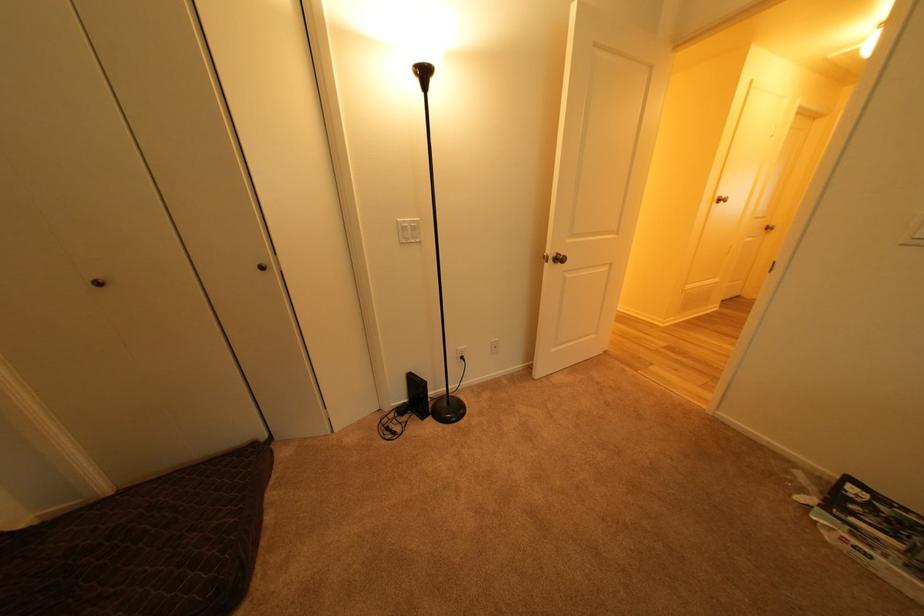
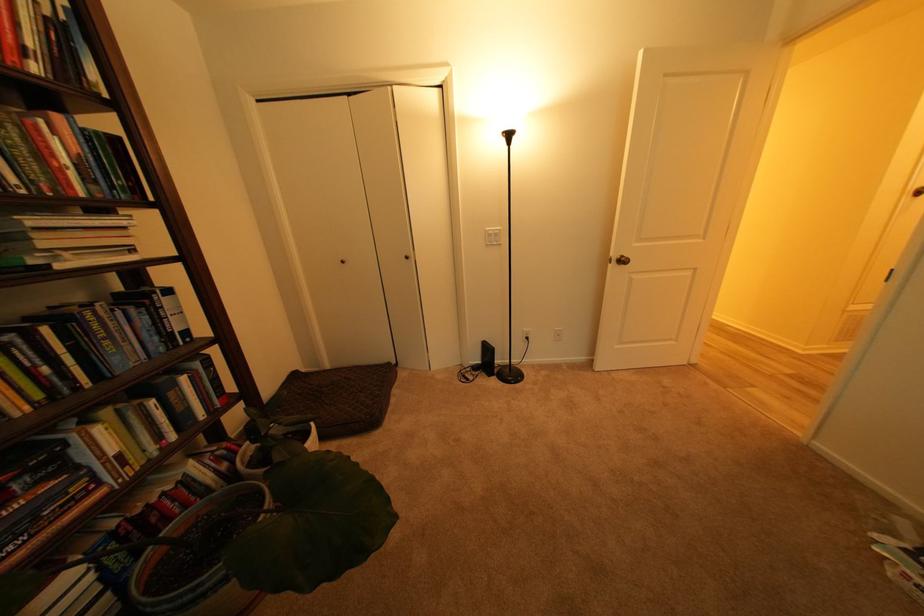
The point at (557,264) is marked in the first image. Where is the corresponding point in the second image?

(621, 265)